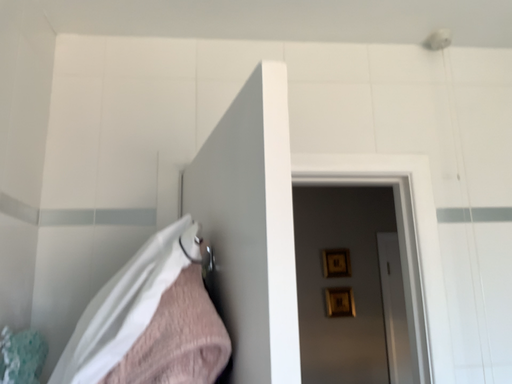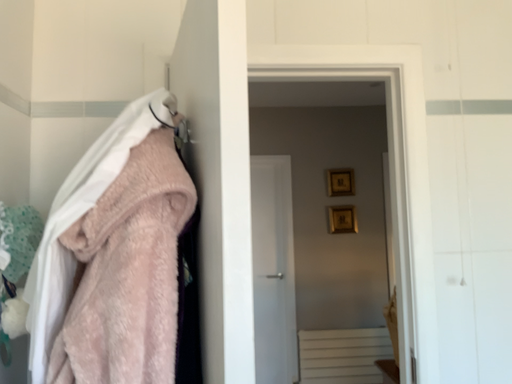
Question: How did the camera likely rotate when shooting the video?

Choices:
 (A) rotated upward
 (B) rotated downward

Answer: (B)